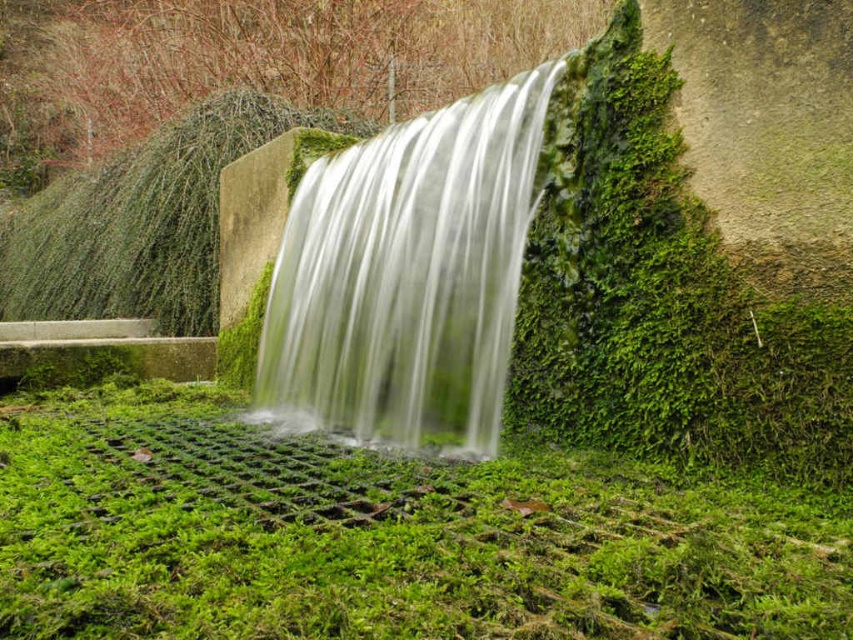
You are a GUI agent. You are given a task and a screenshot of the screen. Output one action in this format:
    pyautogui.click(x=<x>, y=<y>)
    Task: Click on the green mossy grass at center
    
    Given the screenshot: What is the action you would take?
    pyautogui.click(x=383, y=536)

This screenshot has width=853, height=640. What do you see at coordinates (383, 536) in the screenshot? I see `green mossy grass at center` at bounding box center [383, 536].

Which is in front, point (142, 492) or point (480, 189)?

Positioned in front is point (142, 492).

Find the location of a particular element. Image resolution: width=853 pixels, height=640 pixels. green mossy grass at center is located at coordinates (383, 536).